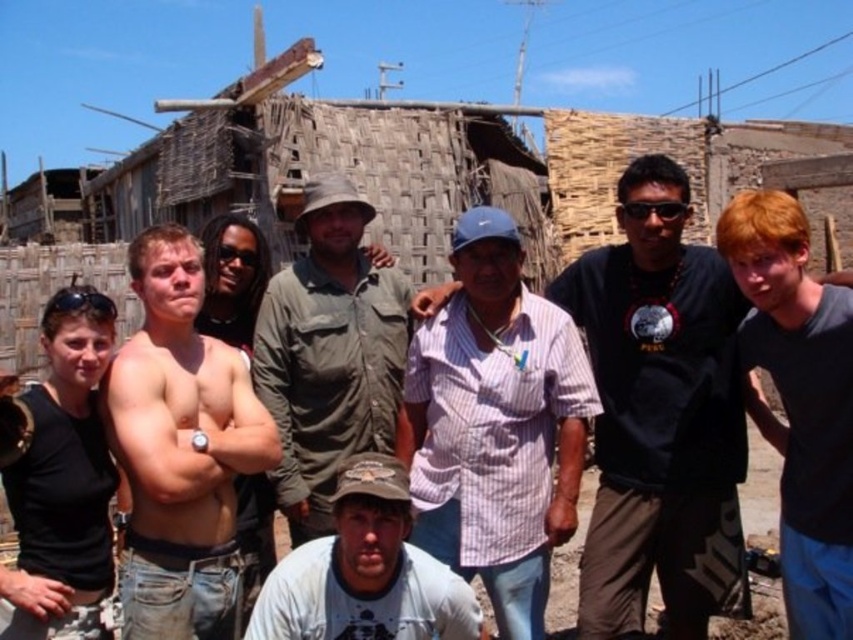
Question: Which of these objects is positioned closest to the light blue cotton shirt at lower center?

Choices:
 (A) dark blue t-shirt at right
 (B) muscular skin at center
 (C) pink striped shirt at center
 (D) black matte tank top at left

Answer: (C)

Question: Does pink striped shirt at center appear under light blue cotton shirt at lower center?

Choices:
 (A) no
 (B) yes

Answer: (A)

Question: Does muscular skin at center have a smaller size compared to black matte tank top at left?

Choices:
 (A) no
 (B) yes

Answer: (A)

Question: Based on their relative distances, which object is nearer to the pink striped shirt at center?

Choices:
 (A) dark blue t-shirt at right
 (B) black matte tank top at left
 (C) muscular skin at center

Answer: (C)

Question: Which object appears farthest from the camera in this image?

Choices:
 (A) green canvas shirt at center
 (B) muscular skin at center

Answer: (A)

Question: Does striped cotton shirt at center have a lesser width compared to dark blue t-shirt at right?

Choices:
 (A) yes
 (B) no

Answer: (B)